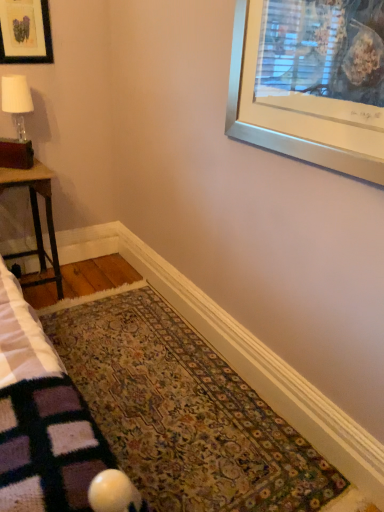
Question: Can you confirm if matte glass lamp at left is taller than wooden table at left?

Choices:
 (A) no
 (B) yes

Answer: (A)

Question: Could you tell me if matte glass lamp at left is facing wooden table at left?

Choices:
 (A) no
 (B) yes

Answer: (A)

Question: Is matte glass lamp at left smaller than wooden table at left?

Choices:
 (A) yes
 (B) no

Answer: (A)

Question: From the image's perspective, is matte glass lamp at left below wooden table at left?

Choices:
 (A) no
 (B) yes

Answer: (A)

Question: Is matte glass lamp at left further to camera compared to wooden table at left?

Choices:
 (A) yes
 (B) no

Answer: (A)

Question: From the image's perspective, is floral carpet at center located above or below wooden table at left?

Choices:
 (A) above
 (B) below

Answer: (B)

Question: Considering their positions, is floral carpet at center located in front of or behind wooden table at left?

Choices:
 (A) behind
 (B) front

Answer: (B)

Question: Considering the positions of floral carpet at center and wooden table at left in the image, is floral carpet at center wider or thinner than wooden table at left?

Choices:
 (A) wide
 (B) thin

Answer: (A)

Question: Considering the positions of floral carpet at center and wooden table at left in the image, is floral carpet at center taller or shorter than wooden table at left?

Choices:
 (A) short
 (B) tall

Answer: (A)

Question: From a real-world perspective, is matte black picture frame at upper left above or below wooden table at left?

Choices:
 (A) below
 (B) above

Answer: (B)

Question: From the image's perspective, is matte black picture frame at upper left positioned above or below wooden table at left?

Choices:
 (A) below
 (B) above

Answer: (B)

Question: In the image, is matte black picture frame at upper left on the left side or the right side of wooden table at left?

Choices:
 (A) right
 (B) left

Answer: (A)

Question: In terms of width, does matte black picture frame at upper left look wider or thinner when compared to wooden table at left?

Choices:
 (A) thin
 (B) wide

Answer: (A)

Question: From the image's perspective, is matte glass lamp at left positioned above or below wooden table at left?

Choices:
 (A) below
 (B) above

Answer: (B)

Question: In terms of size, does matte glass lamp at left appear bigger or smaller than wooden table at left?

Choices:
 (A) small
 (B) big

Answer: (A)